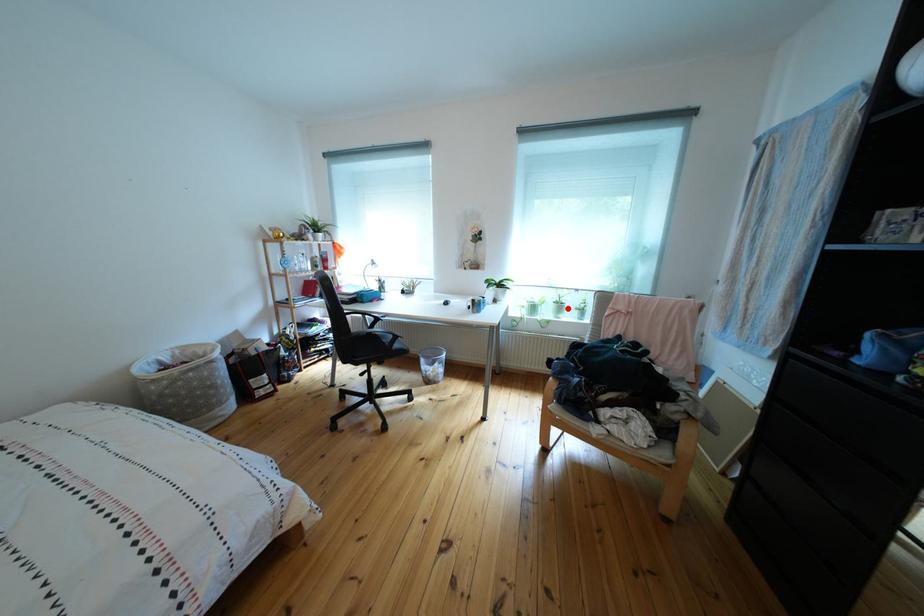
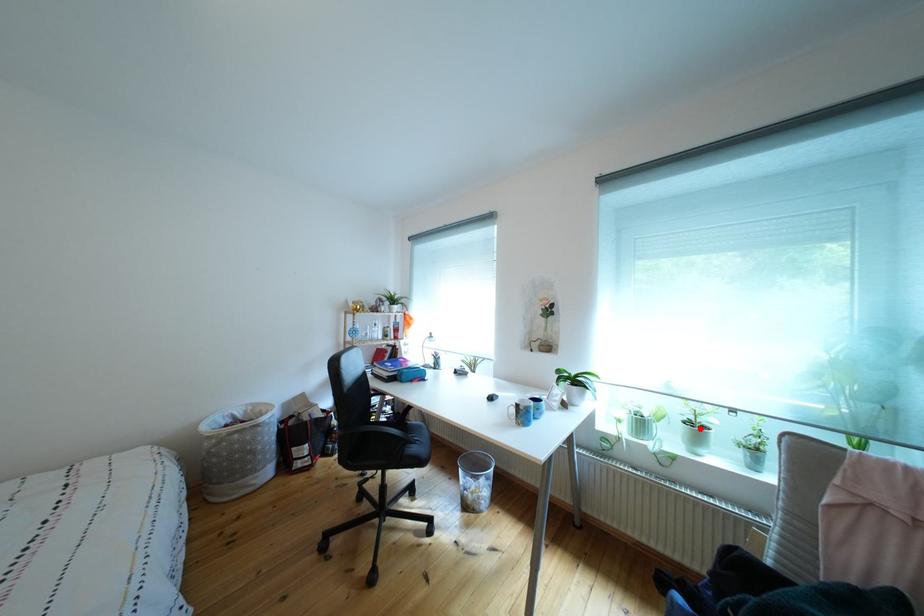
Consider the image. I am providing you with two images of the same scene from different viewpoints. A red point is marked on the first image and another point is marked on the second image. Are the points marked in image1 and image2 representing the same 3D position?

Yes